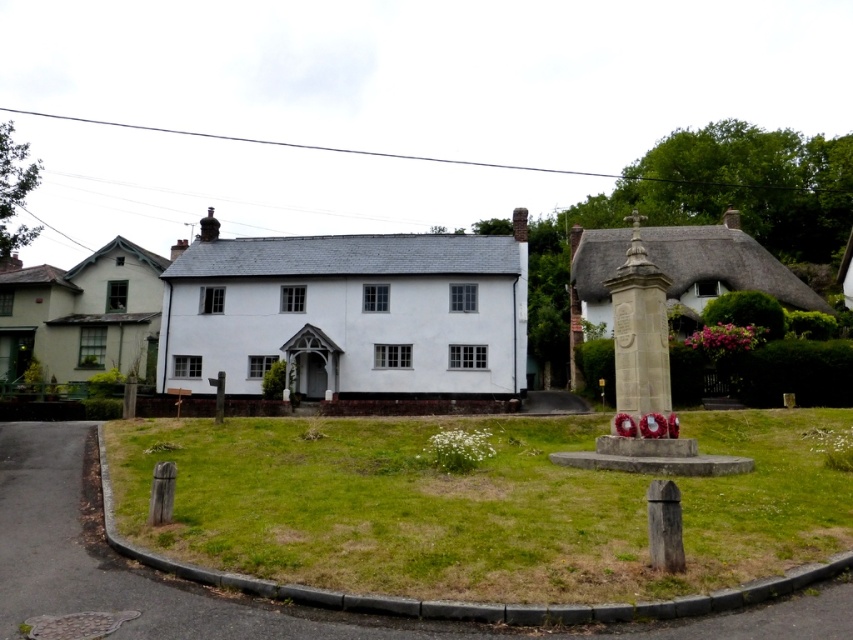
Question: Observing the image, what is the correct spatial positioning of white smooth cottage at center in reference to thatched roof cottage at right?

Choices:
 (A) above
 (B) below

Answer: (B)

Question: Among these objects, which one is nearest to the camera?

Choices:
 (A) brown wooden post at lower right
 (B) thatched roof cottage at right
 (C) light green wood cottage at left
 (D) matte white cottage at left

Answer: (A)

Question: Which point is closer to the camera?

Choices:
 (A) stone monument at center
 (B) white smooth cottage at center

Answer: (A)

Question: Which of the following is the farthest from the observer?

Choices:
 (A) white smooth cottage at center
 (B) light green wood cottage at left
 (C) brown wooden post at lower right

Answer: (B)

Question: Can you confirm if thatched roof cottage at right is positioned to the right of wooden post at lower left?

Choices:
 (A) yes
 (B) no

Answer: (A)

Question: Is white smooth cottage at center above brown wooden post at lower right?

Choices:
 (A) no
 (B) yes

Answer: (B)